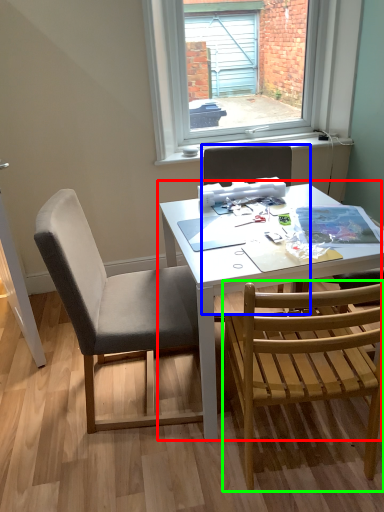
Question: Which is nearer to the table (highlighted by a red box)? chair (highlighted by a blue box) or chair (highlighted by a green box).

Choices:
 (A) chair
 (B) chair

Answer: (B)